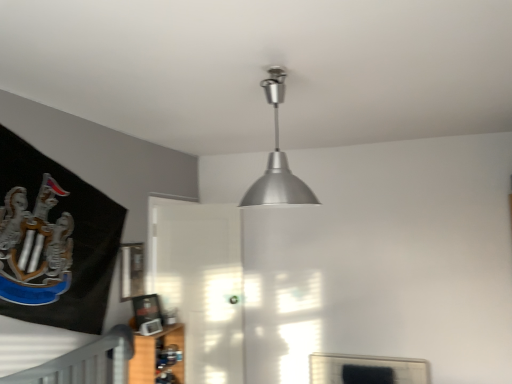
Based on the photo, what is the approximate height of wooden shelf at lower left?

wooden shelf at lower left is 19.29 inches tall.

This screenshot has width=512, height=384. In order to click on transparent glass door at center in this screenshot , I will do `click(200, 283)`.

Would you say wooden shelf at lower left is inside or outside metallic silver picture frame at upper center?

wooden shelf at lower left is spatially situated outside metallic silver picture frame at upper center.

How distant is wooden shelf at lower left from metallic silver picture frame at upper center?

wooden shelf at lower left and metallic silver picture frame at upper center are 17.73 inches apart from each other.

Is wooden shelf at lower left placed right next to metallic silver picture frame at upper center?

No, wooden shelf at lower left is not making contact with metallic silver picture frame at upper center.

Which point is more distant from viewer, (134, 342) or (137, 292)?

The point (137, 292) is more distant.

Between wooden shelf at lower left and transparent glass door at center, which one appears on the left side from the viewer's perspective?

wooden shelf at lower left.

In the scene shown: Considering the relative sizes of wooden shelf at lower left and transparent glass door at center in the image provided, is wooden shelf at lower left taller than transparent glass door at center?

Incorrect, the height of wooden shelf at lower left is not larger of that of transparent glass door at center.

Which is in front, point (146, 372) or point (206, 256)?

Positioned in front is point (146, 372).

From the picture: Could you tell me if wooden shelf at lower left is turned towards transparent glass door at center?

No, wooden shelf at lower left is not turned towards transparent glass door at center.

Where is `picture frame lying behind the silver metallic lampshade at upper center`? The image size is (512, 384). picture frame lying behind the silver metallic lampshade at upper center is located at coordinates (131, 271).

Is metallic silver picture frame at upper center facing away from silver metallic lampshade at upper center?

No, silver metallic lampshade at upper center is not at the back of metallic silver picture frame at upper center.

Does metallic silver picture frame at upper center have a lesser height compared to silver metallic lampshade at upper center?

Yes, metallic silver picture frame at upper center is shorter than silver metallic lampshade at upper center.

Considering the sizes of objects silver metallic lampshade at upper center and transparent glass door at center in the image provided, who is taller, silver metallic lampshade at upper center or transparent glass door at center?

transparent glass door at center is taller.

Is silver metallic lampshade at upper center closer to the viewer compared to transparent glass door at center?

Yes, silver metallic lampshade at upper center is closer to the camera.

Is silver metallic lampshade at upper center wider or thinner than transparent glass door at center?

In the image, silver metallic lampshade at upper center appears to be more narrow than transparent glass door at center.

Is wooden shelf at lower left oriented away from silver metallic lampshade at upper center?

No, silver metallic lampshade at upper center is not at the back of wooden shelf at lower left.

In the scene shown: Is wooden shelf at lower left far away from silver metallic lampshade at upper center?

Yes, wooden shelf at lower left and silver metallic lampshade at upper center are located far from each other.

Is wooden shelf at lower left wider or thinner than silver metallic lampshade at upper center?

Considering their sizes, wooden shelf at lower left looks slimmer than silver metallic lampshade at upper center.

Considering the positions of objects silver metallic lampshade at upper center and metallic silver picture frame at upper center in the image provided, who is behind, silver metallic lampshade at upper center or metallic silver picture frame at upper center?

metallic silver picture frame at upper center is more distant.

Can you confirm if silver metallic lampshade at upper center is taller than metallic silver picture frame at upper center?

Indeed, silver metallic lampshade at upper center has a greater height compared to metallic silver picture frame at upper center.

Which of these two, silver metallic lampshade at upper center or metallic silver picture frame at upper center, is thinner?

Thinner between the two is metallic silver picture frame at upper center.

From a real-world perspective, is silver metallic lampshade at upper center positioned over metallic silver picture frame at upper center based on gravity?

Correct, in the physical world, silver metallic lampshade at upper center is higher than metallic silver picture frame at upper center.

Is point (227, 324) closer to viewer compared to point (135, 246)?

No, (227, 324) is behind (135, 246).

Where is `glass door below the metallic silver picture frame at upper center (from a real-world perspective)`? This screenshot has width=512, height=384. glass door below the metallic silver picture frame at upper center (from a real-world perspective) is located at coordinates (200, 283).

From a real-world perspective, between transparent glass door at center and metallic silver picture frame at upper center, who is vertically lower?

From a 3D spatial view, transparent glass door at center is below.

Does transparent glass door at center have a greater height compared to metallic silver picture frame at upper center?

Yes.

I want to click on shelf on the right of metallic silver picture frame at upper center, so click(x=151, y=353).

Identify the location of shelf on the left of transparent glass door at center. This screenshot has height=384, width=512. (151, 353).

Looking at the image, which one is located closer to silver metallic lampshade at upper center, metallic silver picture frame at upper center or transparent glass door at center?

transparent glass door at center.

Which object lies nearer to the anchor point metallic silver picture frame at upper center, transparent glass door at center or wooden shelf at lower left?

Based on the image, wooden shelf at lower left appears to be nearer to metallic silver picture frame at upper center.

From the image, which object appears to be farther from transparent glass door at center, wooden shelf at lower left or silver metallic lampshade at upper center?

silver metallic lampshade at upper center is further to transparent glass door at center.

From the image, which object appears to be nearer to transparent glass door at center, silver metallic lampshade at upper center or metallic silver picture frame at upper center?

metallic silver picture frame at upper center is closer to transparent glass door at center.

Estimate the real-world distances between objects in this image. Which object is further from metallic silver picture frame at upper center, transparent glass door at center or silver metallic lampshade at upper center?

Among the two, silver metallic lampshade at upper center is located further to metallic silver picture frame at upper center.

When comparing their distances from silver metallic lampshade at upper center, does transparent glass door at center or metallic silver picture frame at upper center seem further?

metallic silver picture frame at upper center is further to silver metallic lampshade at upper center.

Estimate the real-world distances between objects in this image. Which object is further from wooden shelf at lower left, transparent glass door at center or metallic silver picture frame at upper center?

Among the two, transparent glass door at center is located further to wooden shelf at lower left.

Considering their positions, is wooden shelf at lower left positioned further to metallic silver picture frame at upper center than silver metallic lampshade at upper center?

Based on the image, silver metallic lampshade at upper center appears to be further to metallic silver picture frame at upper center.

You are a GUI agent. You are given a task and a screenshot of the screen. Output one action in this format:
    pyautogui.click(x=<x>, y=<y>)
    Task: Click on the shelf between silver metallic lampshade at upper center and transparent glass door at center along the z-axis
    
    Given the screenshot: What is the action you would take?
    pyautogui.click(x=151, y=353)

This screenshot has height=384, width=512. In order to click on shelf between silver metallic lampshade at upper center and metallic silver picture frame at upper center along the z-axis in this screenshot , I will do `click(151, 353)`.

The width and height of the screenshot is (512, 384). I want to click on glass door between metallic silver picture frame at upper center and wooden shelf at lower left in the up-down direction, so click(200, 283).

Locate an element on the screen. Image resolution: width=512 pixels, height=384 pixels. picture frame positioned between silver metallic lampshade at upper center and transparent glass door at center from near to far is located at coordinates (131, 271).